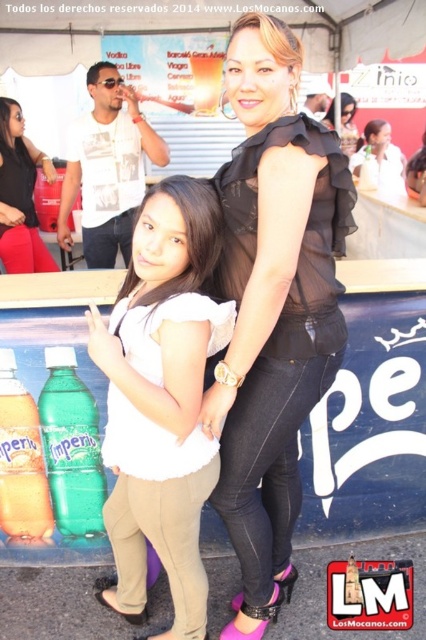
You are an event organizer looking at this festival scene. You notice two black tops in the image. The first is a black sheer blouse at center and the second is a matte black top at upper center. Which of these two items is positioned lower in the image?

The black sheer blouse at center is located below the matte black top at upper center, so the black sheer blouse at center is positioned lower in the image.

You are organizing a clothing rack and need to place the black sheer blouse at center and the translucent plastic bottle at lower left next to each other. Which item requires more horizontal space on the rack?

The black sheer blouse at center requires more horizontal space on the rack because its width is larger than the translucent plastic bottle at lower left.

In the festival scene, you notice two items at the center and lower left. The black sheer blouse at center and the translucent plastic bottle at lower left. Which item is closer to the viewer?

The black sheer blouse at center is closer to the viewer because it is in front of the translucent plastic bottle at lower left.